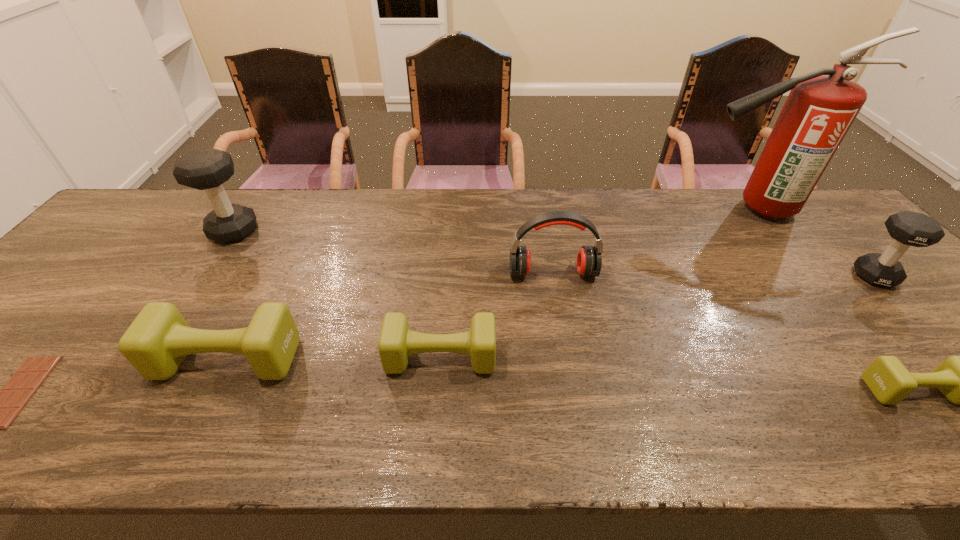
You are a GUI agent. You are given a task and a screenshot of the screen. Output one action in this format:
    pyautogui.click(x=<x>, y=<y>)
    Task: Click on the free space between the farthest dumbbell and the third tallest dumbbell
    The image size is (960, 540).
    Given the screenshot: What is the action you would take?
    pyautogui.click(x=231, y=295)

This screenshot has height=540, width=960. Identify the location of unoccupied area between the smaller gray dumbbell and the tallest object. (814, 242).

Locate an element on the screen. vacant point located between the tallest object and the fifth object from left to right is located at coordinates (653, 241).

Locate an element on the screen. This screenshot has height=540, width=960. unoccupied position between the tallest object and the second smallest olive dumbbell is located at coordinates pos(597,284).

This screenshot has width=960, height=540. Find the location of `empty space between the sixth tallest object and the second tallest dumbbell`. empty space between the sixth tallest object and the second tallest dumbbell is located at coordinates (658, 317).

Find the location of `free space between the seventh shortest object and the earphone`. free space between the seventh shortest object and the earphone is located at coordinates (394, 252).

This screenshot has height=540, width=960. Find the location of `the sixth closest object to the third dumbbell from right to left`. the sixth closest object to the third dumbbell from right to left is located at coordinates (959, 378).

Locate which object ranks sixth in proximity to the right gray dumbbell. Please provide its 2D coordinates. Your answer should be formatted as a tuple, i.e. [(x, y)], where the tuple contains the x and y coordinates of a point satisfying the conditions above.

[(207, 169)]

You are a GUI agent. You are given a task and a screenshot of the screen. Output one action in this format:
    pyautogui.click(x=<x>, y=<y>)
    Task: Click on the dumbbell object that ranks as the third closest to the chocolate bar
    This screenshot has width=960, height=540.
    Given the screenshot: What is the action you would take?
    pyautogui.click(x=396, y=343)

Choose which dumbbell is the third nearest neighbor to the tallest dumbbell. Please provide its 2D coordinates. Your answer should be formatted as a tuple, i.e. [(x, y)], where the tuple contains the x and y coordinates of a point satisfying the conditions above.

[(959, 378)]